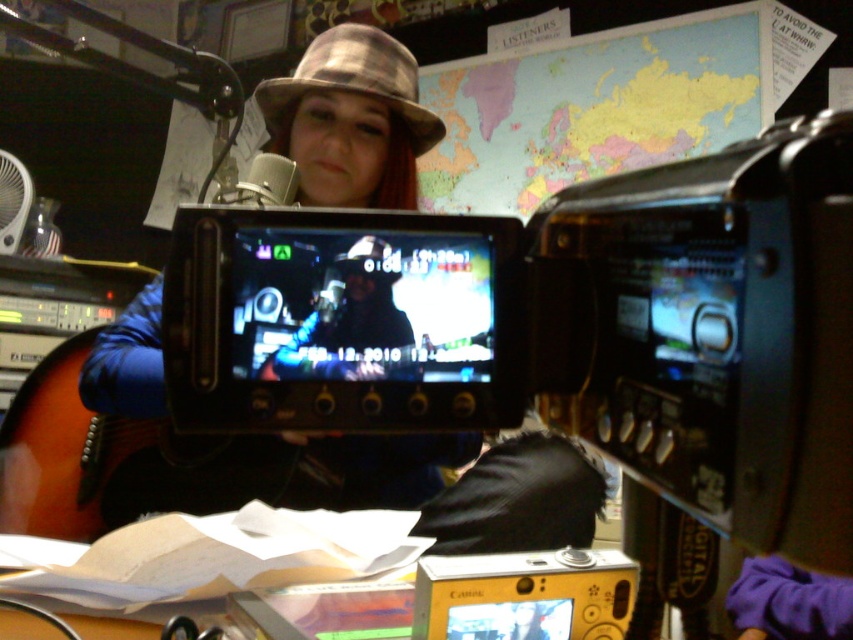
Question: Which of the following is the closest to the observer?

Choices:
 (A) (331, 269)
 (B) (392, 67)
 (C) (387, 248)

Answer: (A)

Question: From the image, what is the correct spatial relationship of shiny black jacket at center in relation to metallic fabric hat at center?

Choices:
 (A) left
 (B) right

Answer: (B)

Question: Which point is farther from the camera taking this photo?

Choices:
 (A) (393, 51)
 (B) (386, 273)
 (C) (344, 268)

Answer: (A)

Question: Can you confirm if yellow plastic camera at lower center is positioned to the right of metallic fabric hat at center?

Choices:
 (A) yes
 (B) no

Answer: (A)

Question: Estimate the real-world distances between objects in this image. Which object is farther from the shiny black jacket at center?

Choices:
 (A) metallic fabric hat at center
 (B) shiny metallic hat at center

Answer: (A)

Question: Does shiny black jacket at center have a larger size compared to shiny metallic hat at center?

Choices:
 (A) no
 (B) yes

Answer: (B)